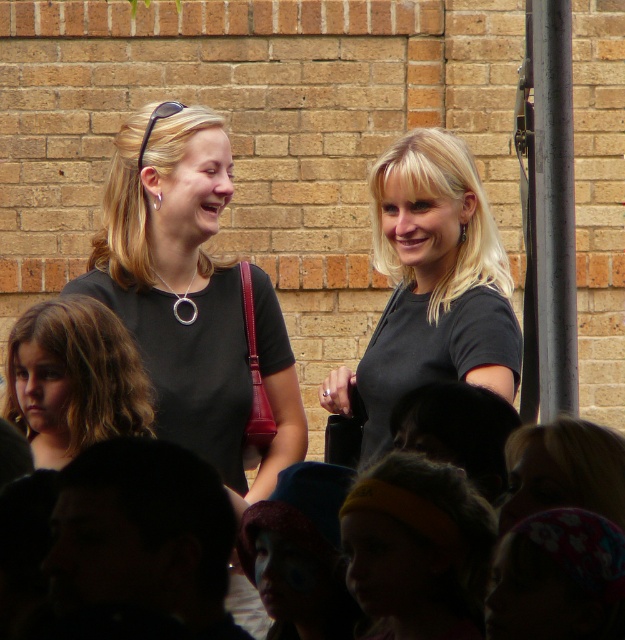
You are a photographer trying to capture the scene. You notice the black matte shirt at center and the blonde hair at lower left. Which object is positioned higher in the image?

The black matte shirt at center is located above the blonde hair at lower left, so it is positioned higher in the image.

You are a photographer setting up a shot of the scene. You need to ensure that the black matte shirt at center and the metallic pole at right are both in frame. Given that your camera has a fixed focal length, which object should you prioritize positioning closer to the camera to ensure both are fully visible?

The black matte shirt at center might be wider than metallic pole at right, so you should prioritize positioning the black matte shirt at center closer to the camera to ensure both are fully visible.

In the scene shown: Based on the scene description, where is the matte black shirt at center located in terms of coordinates?

The matte black shirt at center is located at point coordinates of [191,296].